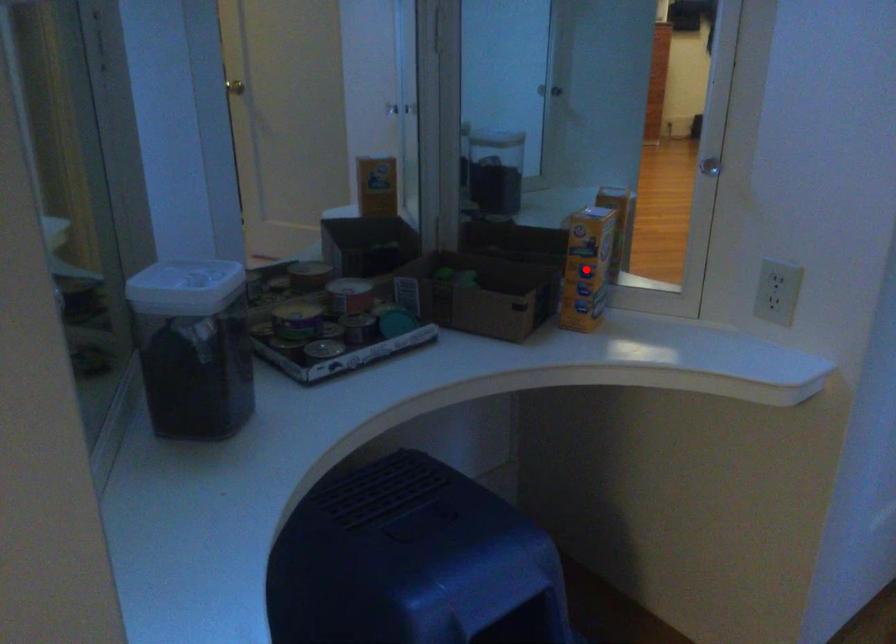
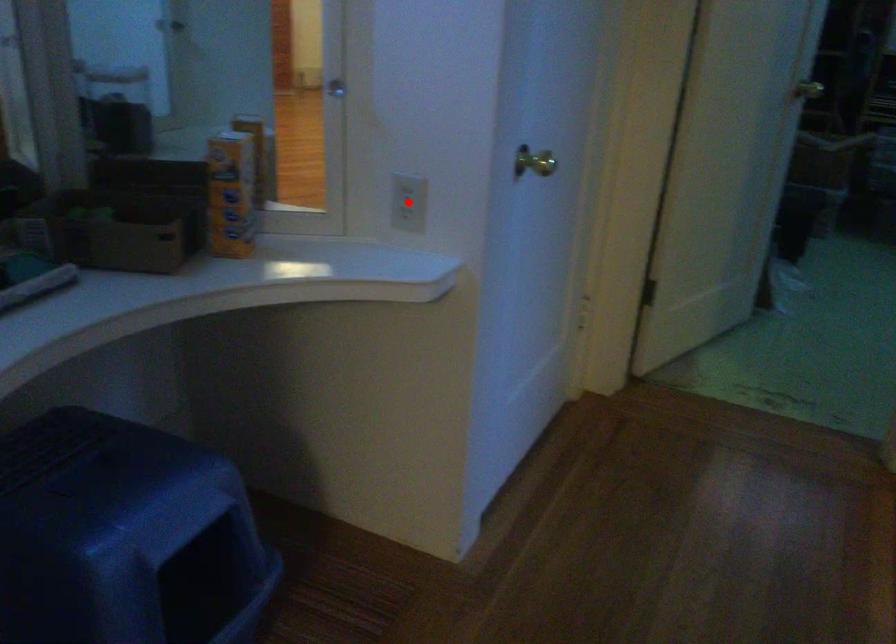
I am providing you with two images of the same scene from different viewpoints. A red point is marked on the first image and another point is marked on the second image. Is the marked point in image1 the same physical position as the marked point in image2?

No